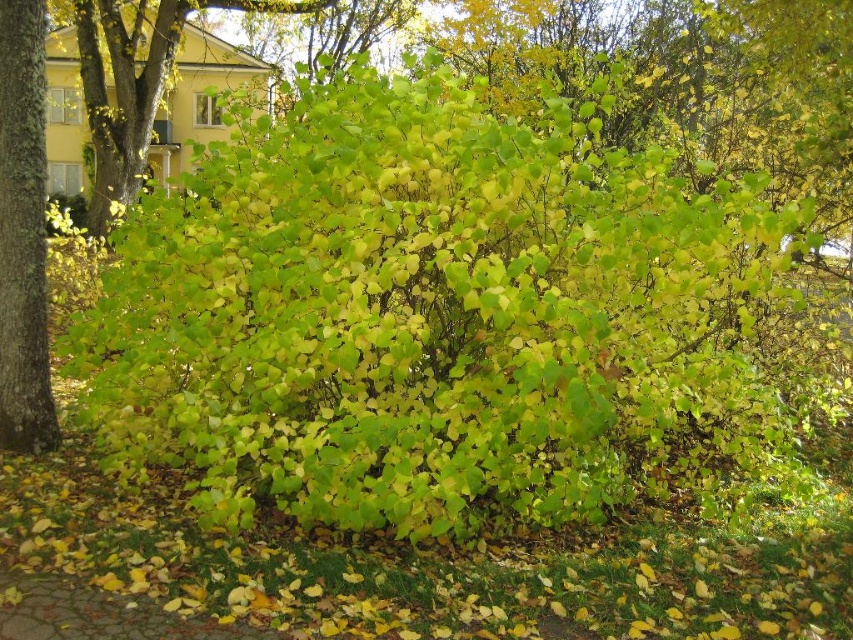
Question: Does green rough bark tree at left have a lesser width compared to cobblestone path at lower left?

Choices:
 (A) no
 (B) yes

Answer: (B)

Question: Based on their relative distances, which object is nearer to the green leafy bush at upper center?

Choices:
 (A) green leafy bush at center
 (B) green rough bark tree at left
 (C) cobblestone path at lower left

Answer: (B)

Question: Does green leafy bush at center come behind cobblestone path at lower left?

Choices:
 (A) yes
 (B) no

Answer: (A)

Question: Can you confirm if green leafy bush at upper center is positioned below cobblestone path at lower left?

Choices:
 (A) no
 (B) yes

Answer: (A)

Question: Which object is the closest to the green leafy bush at upper center?

Choices:
 (A) green rough bark tree at left
 (B) green leafy bush at center

Answer: (A)

Question: Which of the following is the farthest from the observer?

Choices:
 (A) green leafy bush at center
 (B) cobblestone path at lower left

Answer: (A)